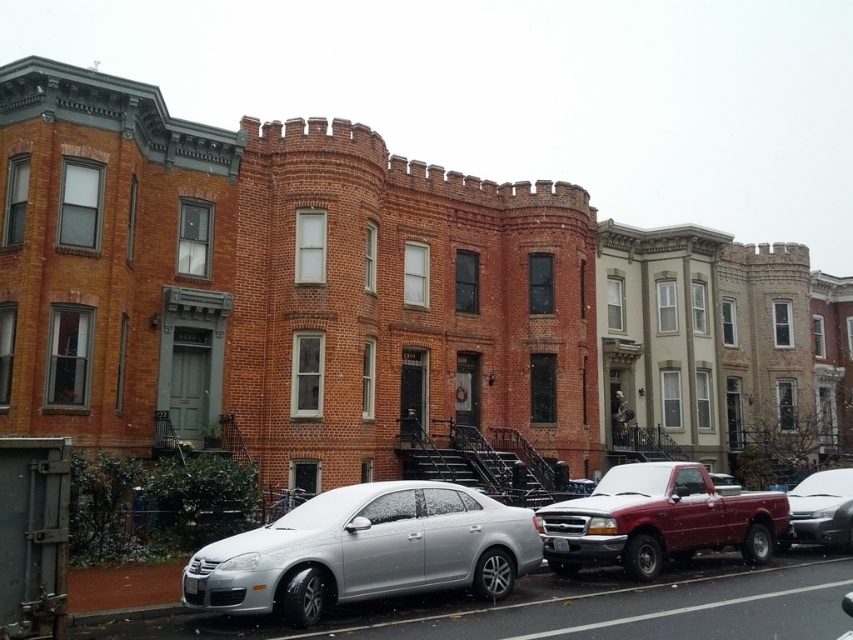
You are standing on the street in front of the buildings. You see two points marked on the buildings. The first point is at coordinate point (440, 588) and the second is at point (733, 540). Which point is closer to you?

Point (440, 588) is closer to the viewer than point (733, 540).

You are driving a car and want to park your vehicle in the parking spot between the two buildings. The parking spot is located between the satin silver sedan at lower left and the silver metallic sedan at center. Can you determine which side of the parking spot you should enter from?

The satin silver sedan at lower left is to the left of the silver metallic sedan at center, so you should enter the parking spot from the left side of the satin silver sedan at lower left to position your car correctly between them.

What is the color of the object located at point (659, 520) in the image?

The object at point (659, 520) is a shiny red pickup truck.